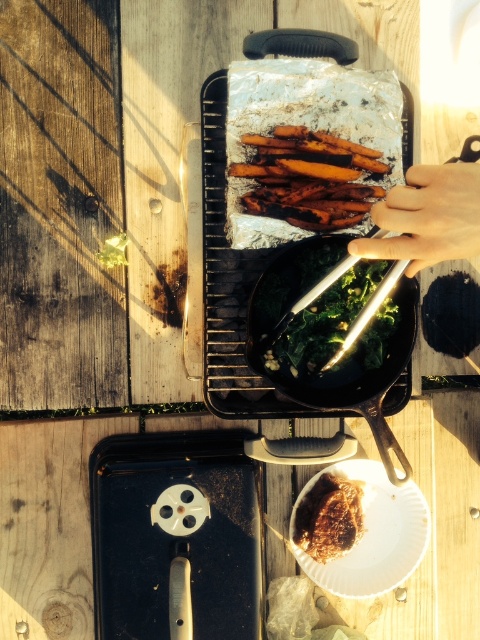
Question: Estimate the real-world distances between objects in this image. Which object is farther from the brown crispy meat at center?

Choices:
 (A) charred wooden skewers at center
 (B) green leafymaterial/texturevegetable at center

Answer: (A)

Question: Does charred wooden skewers at center come in front of brown paper plate at lower center?

Choices:
 (A) no
 (B) yes

Answer: (B)

Question: Which is nearer to the green leafymaterial/texturevegetable at center?

Choices:
 (A) brown crispy meat at center
 (B) brown skin at center
 (C) black cast iron skillet at center

Answer: (C)

Question: Is brown skin at center to the right of green leafymaterial/texturevegetable at center from the viewer's perspective?

Choices:
 (A) yes
 (B) no

Answer: (A)

Question: Which point is closer to the camera taking this photo?

Choices:
 (A) (337, 268)
 (B) (228, 172)
 (C) (257, 339)
 (D) (395, 570)

Answer: (A)

Question: Does charred wooden skewers at center come behind brown skin at center?

Choices:
 (A) yes
 (B) no

Answer: (A)